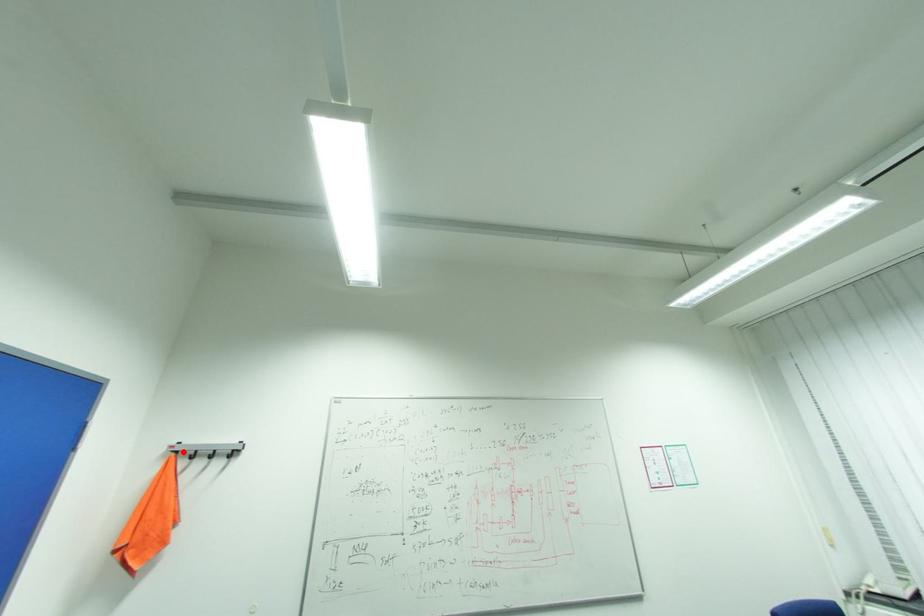
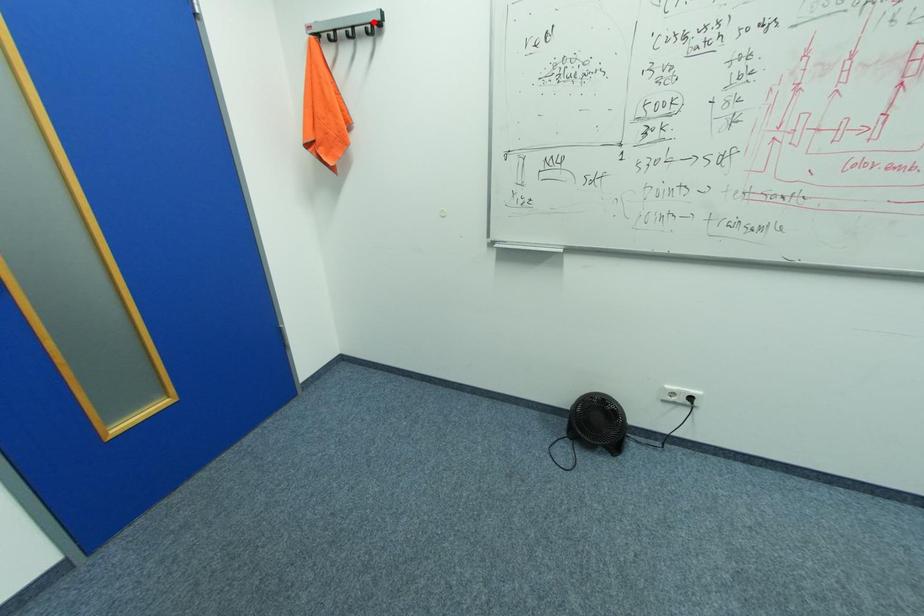
I am providing you with two images of the same scene from different viewpoints. A red point is marked on the first image and another point is marked on the second image. Is the marked point in image1 the same physical position as the marked point in image2?

No